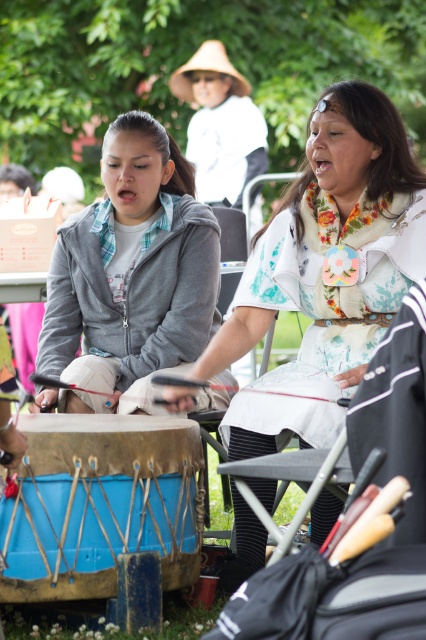
You are a photographer wanting to capture both the gray fleece jacket at center and the blue leather drum at lower left in a single shot. Based on their positions, which object should you focus on first to ensure both are in frame?

The gray fleece jacket at center is located above the blue leather drum at lower left, so focusing on the gray fleece jacket at center first will ensure both are in frame.

What is the color of the dress worn by the person at the coordinates point (333, 246)?

The dress at point (333, 246) is matte white.

You are a photographer trying to capture a photo of the matte white dress at center and the blue leather drum at lower left. Since you want to focus on both subjects equally, which object should you zoom in on to ensure both fit in the frame?

The matte white dress at center is wider than the blue leather drum at lower left, so you should zoom in on the matte white dress at center to ensure both fit in the frame.